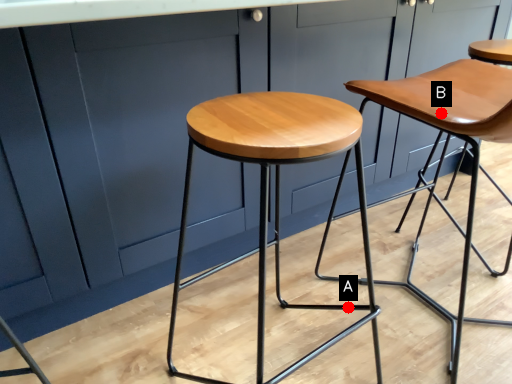
Question: Two points are circled on the image, labeled by A and B beside each circle. Which point appears closest to the camera in this image?

Choices:
 (A) A is closer
 (B) B is closer

Answer: (B)